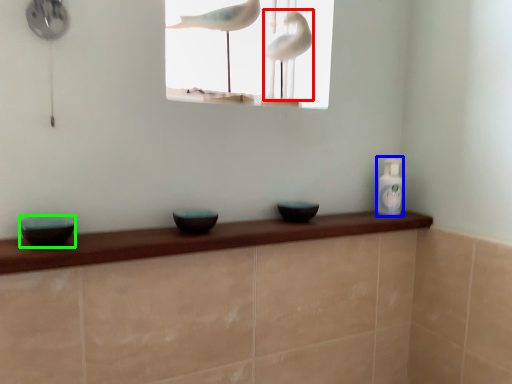
Question: Which object is the farthest from bird (highlighted by a red box)? Choose among these: bottle (highlighted by a blue box) or basin (highlighted by a green box).

Choices:
 (A) bottle
 (B) basin

Answer: (B)